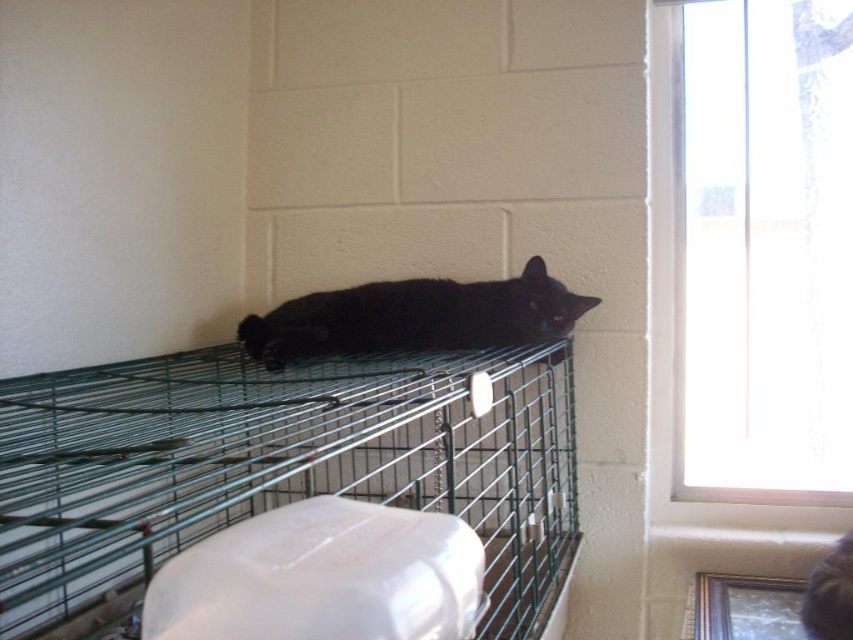
You are a volunteer at an animal shelter and need to clean the green wire cage at upper center. The black matte fur cat at center is currently resting on it. How can you safely move the cat to access the cage?

The green wire cage at upper center is positioned under the black matte fur cat at center, so you should gently move the cat off the cage before cleaning it.

You are a photographer trying to capture a closeup of the green wire cage at upper center. Given that your camera can focus on objects within 12 inches, will you need to move closer or farther away to get a clear shot?

The green wire cage at upper center is 13.24 inches away from the camera, which is beyond the 12 inch focus range. You need to move closer to get a clear shot.